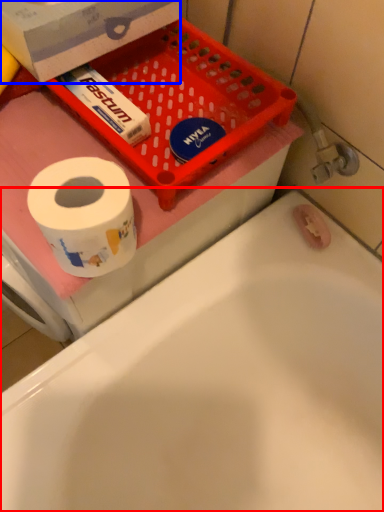
Question: Which point is further to the camera, bathtub (highlighted by a red box) or box (highlighted by a blue box)?

Choices:
 (A) bathtub
 (B) box

Answer: (B)